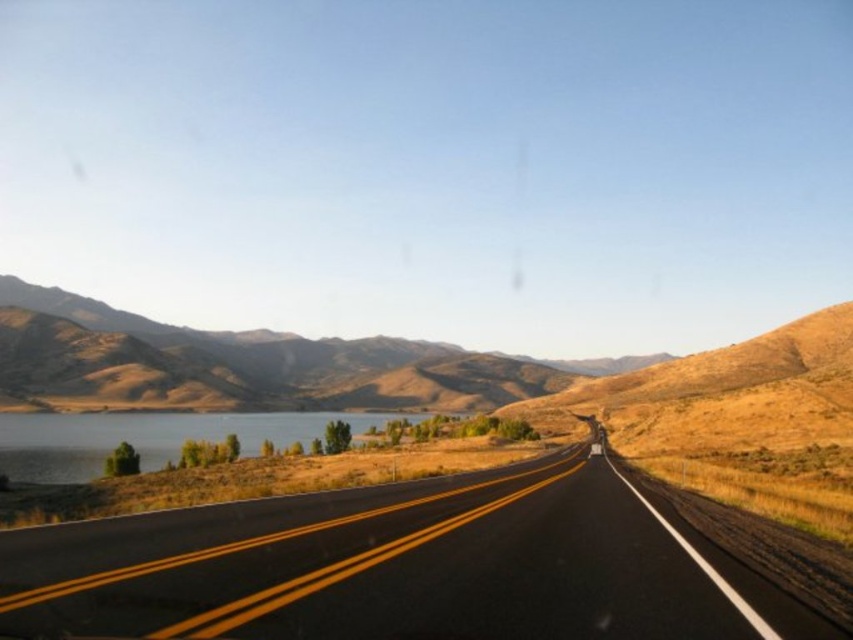
Question: Does black asphalt highway at center appear over brown textured hill at left?

Choices:
 (A) no
 (B) yes

Answer: (A)

Question: Can you confirm if black asphalt highway at center is positioned below shiny blue water at left?

Choices:
 (A) yes
 (B) no

Answer: (B)

Question: Which of the following is the closest to the observer?

Choices:
 (A) (155, 348)
 (B) (165, 444)

Answer: (B)

Question: Among these objects, which one is nearest to the camera?

Choices:
 (A) shiny blue water at left
 (B) brown textured hill at left

Answer: (A)

Question: Is black asphalt highway at center to the left of brown textured hill at left from the viewer's perspective?

Choices:
 (A) yes
 (B) no

Answer: (B)

Question: Which point appears farthest from the camera in this image?

Choices:
 (A) (9, 444)
 (B) (471, 387)

Answer: (B)